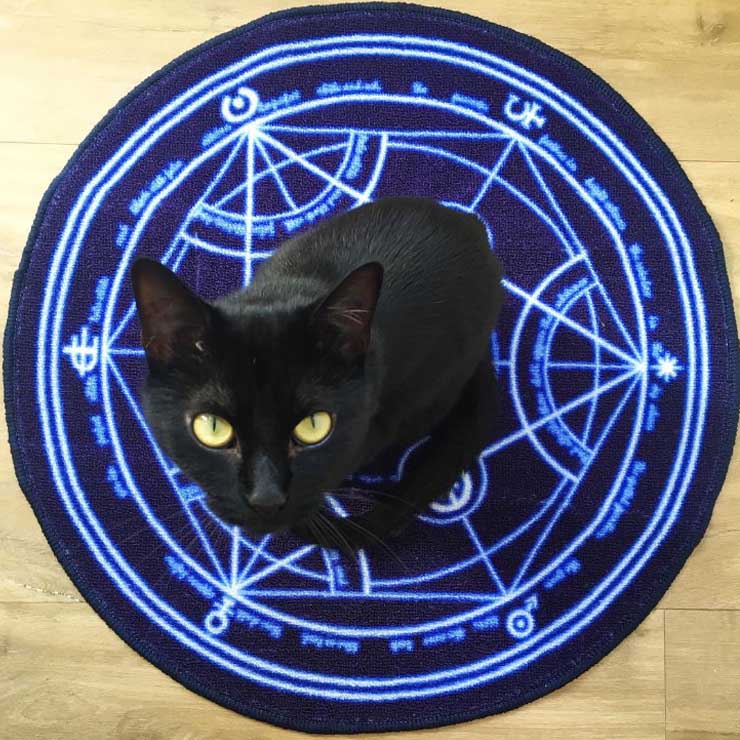
You are a GUI agent. You are given a task and a screenshot of the screen. Output one action in this format:
    pyautogui.click(x=<x>, y=<y>)
    Task: Click on the carpet
    This screenshot has height=740, width=740.
    Given the screenshot: What is the action you would take?
    pyautogui.click(x=334, y=158)